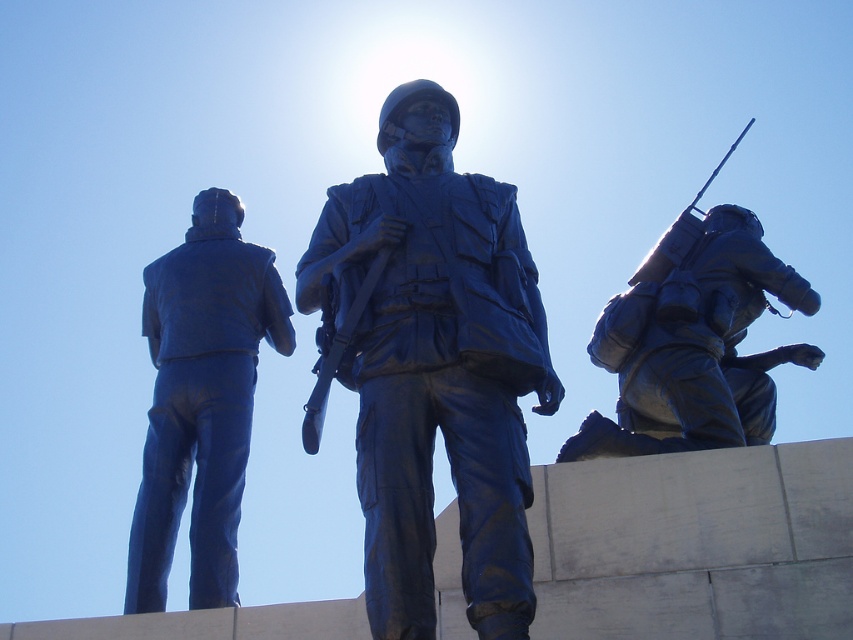
You are a drone operator trying to locate the blue polished metal soldier at center in the image. Using a coordinate system where the bottom left corner is the origin, can you confirm if the soldier is positioned closer to the center of the platform or near the edge?

The blue polished metal soldier at center is located at point coordinates that are nearly the center of the platform, so it is positioned closer to the center.

You are standing in front of the statues and want to know how far the point at coordinates point [306,310] is from you. Can you determine the distance?

The point [306,310] is 56.12 meters from the viewer.

From the picture: You are an art curator planning to display the blue polished metal soldier at center and the blue polished statue at left in a gallery. The gallery has a narrow corridor that can only accommodate statues up to 1.2 meters in width. Which statue should you choose to display in the corridor to ensure it fits?

The blue polished statue at left should be chosen because its width is smaller than the blue polished metal soldier at center, making it more likely to fit within the 1.2 meters width restriction of the corridor.